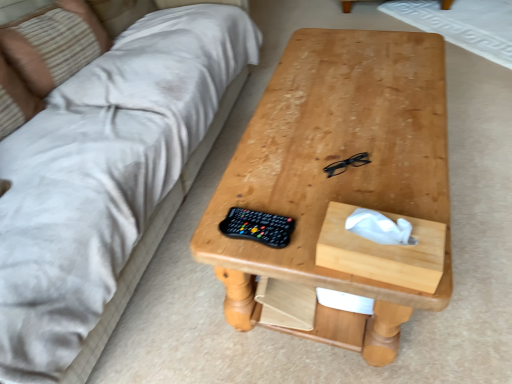
Question: Visually, is wooden tissue box at center-right positioned to the left or to the right of natural wood table at center?

Choices:
 (A) left
 (B) right

Answer: (A)

Question: Is wooden tissue box at center-right bigger or smaller than natural wood table at center?

Choices:
 (A) big
 (B) small

Answer: (B)

Question: Considering the real-world distances, which object is closest to the beige fabric couch at upper left?

Choices:
 (A) black plastic glasses at center
 (B) natural wood table at center
 (C) wooden tissue box at center-right
 (D) beige striped pillow at upper left

Answer: (D)

Question: Which object is positioned closest to the beige striped pillow at upper left?

Choices:
 (A) wooden tissue box at center-right
 (B) black plastic glasses at center
 (C) natural wood table at center
 (D) beige fabric couch at upper left

Answer: (D)